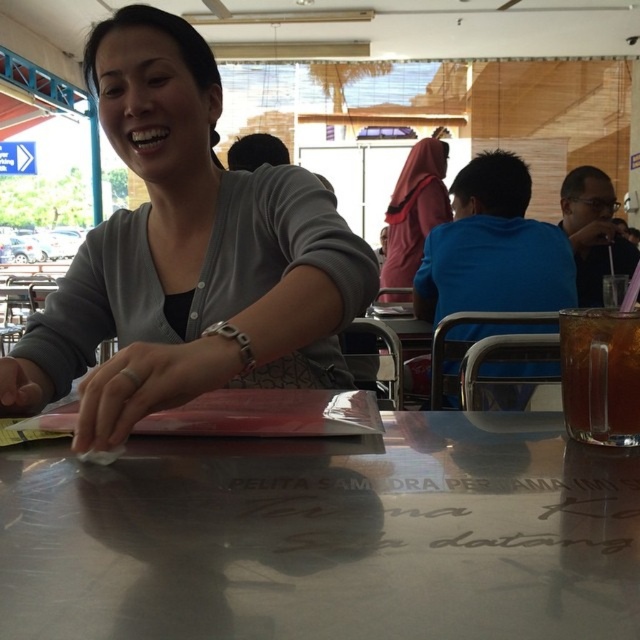
Between translucent glass cup at lower right and matte pink hijab at center, which one has less height?

Standing shorter between the two is translucent glass cup at lower right.

Is translucent glass cup at lower right positioned before matte pink hijab at center?

Yes, it is in front of matte pink hijab at center.

What are the coordinates of `translucent glass cup at lower right` in the screenshot? It's located at (600, 374).

Does point (179, 35) lie behind point (611, 406)?

Yes.

Between matte gray cardigan at center and translucent glass cup at lower right, which one has more height?

With more height is matte gray cardigan at center.

Image resolution: width=640 pixels, height=640 pixels. I want to click on matte gray cardigan at center, so click(186, 256).

Between point (173, 545) and point (404, 278), which one is positioned behind?

Point (404, 278)

Image resolution: width=640 pixels, height=640 pixels. What do you see at coordinates (326, 536) in the screenshot?
I see `metallic silver table at center` at bounding box center [326, 536].

Does point (522, 541) come farther from viewer compared to point (428, 179)?

No.

Where is `metallic silver table at center`? metallic silver table at center is located at coordinates (326, 536).